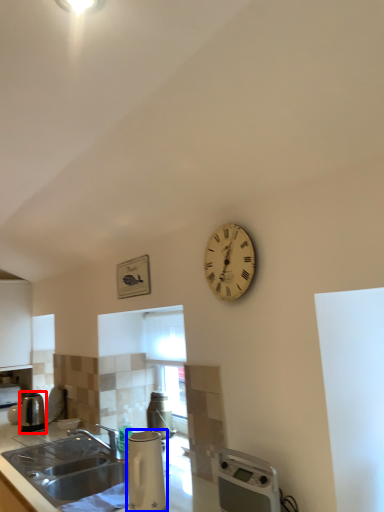
Question: Which object appears closest to the camera in this image, kitchen appliance (highlighted by a red box) or appliance (highlighted by a blue box)?

Choices:
 (A) kitchen appliance
 (B) appliance

Answer: (B)